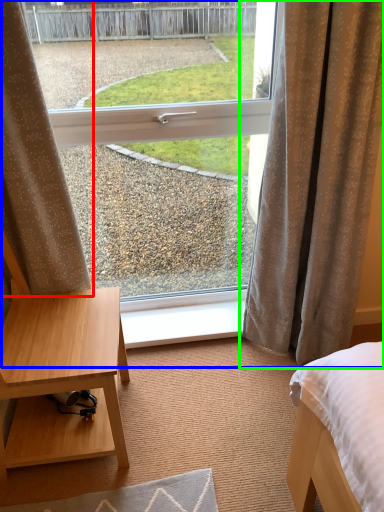
Question: Which is nearer to the curtain (highlighted by a red box)? window (highlighted by a blue box) or curtain (highlighted by a green box).

Choices:
 (A) window
 (B) curtain

Answer: (B)